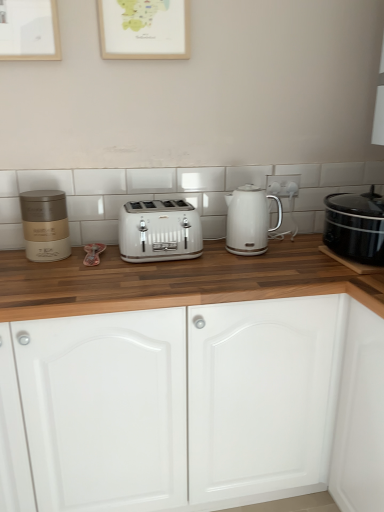
Describe the element at coordinates (159, 231) in the screenshot. I see `white metallic toaster at center` at that location.

The height and width of the screenshot is (512, 384). What do you see at coordinates (177, 281) in the screenshot? I see `white glossy cabinet doors at center` at bounding box center [177, 281].

Identify the location of white glossy cabinet doors at center. The image size is (384, 512). (177, 281).

The height and width of the screenshot is (512, 384). What are the coordinates of `white glossy electric outlet at upper center` in the screenshot? It's located at (283, 185).

Find the location of a particular element. The image size is (384, 512). white metallic toaster at center is located at coordinates (159, 231).

Between white glossy cabinet doors at center and white glossy electric outlet at upper center, which one appears on the left side from the viewer's perspective?

white glossy cabinet doors at center is more to the left.

Which object is thinner, white glossy cabinet doors at center or white glossy electric outlet at upper center?

Thinner between the two is white glossy electric outlet at upper center.

Looking at this image, considering the relative sizes of white glossy cabinet doors at center and white glossy electric outlet at upper center in the image provided, is white glossy cabinet doors at center shorter than white glossy electric outlet at upper center?

No, white glossy cabinet doors at center is not shorter than white glossy electric outlet at upper center.

The height and width of the screenshot is (512, 384). Find the location of `picture frame on the right of matte gold container at left`. picture frame on the right of matte gold container at left is located at coordinates (144, 29).

Considering the positions of point (130, 21) and point (55, 253), is point (130, 21) closer or farther from the camera than point (55, 253)?

Clearly, point (130, 21) is closer to the camera than point (55, 253).

Is matte gold container at left completely or partially inside wooden picture frame at upper center?

No.

Are wooden picture frame at upper center and matte gold container at left beside each other?

wooden picture frame at upper center is not next to matte gold container at left, and they're not touching.

Is white glossy electric kettle at center inside or outside of white glossy cabinet doors at center?

white glossy electric kettle at center exists outside the volume of white glossy cabinet doors at center.

In the image, is white glossy electric kettle at center on the left side or the right side of white glossy cabinet doors at center?

white glossy electric kettle at center is positioned on white glossy cabinet doors at center's right side.

Is white glossy electric kettle at center bigger or smaller than white glossy cabinet doors at center?

white glossy electric kettle at center is smaller than white glossy cabinet doors at center.

From a real-world perspective, which is physically below, white glossy cabinet doors at center or matte gold container at left?

From a 3D spatial view, white glossy cabinet doors at center is below.

Is matte gold container at left surrounded by white glossy cabinet doors at center?

No.

Which object is positioned more to the right, white glossy cabinet doors at center or matte gold container at left?

white glossy cabinet doors at center.

Is matte gold container at left at the back of white glossy cabinet doors at center?

That's not correct — white glossy cabinet doors at center is not looking away from matte gold container at left.

From the image's perspective, is white glossy cabinet doors at center below white glossy electric kettle at center?

Indeed, from the image's perspective, white glossy cabinet doors at center is shown beneath white glossy electric kettle at center.

Is point (199, 297) positioned behind point (240, 227)?

No, it is not.

Considering the sizes of objects white glossy cabinet doors at center and white glossy electric kettle at center in the image provided, who is wider, white glossy cabinet doors at center or white glossy electric kettle at center?

With larger width is white glossy cabinet doors at center.

Is wooden picture frame at upper center in front of or behind white glossy cabinet doors at center in the image?

Visually, wooden picture frame at upper center is located behind white glossy cabinet doors at center.

This screenshot has width=384, height=512. In order to click on picture frame on the right of white glossy cabinet doors at center in this screenshot , I will do `click(144, 29)`.

Which of these two, wooden picture frame at upper center or white glossy cabinet doors at center, is smaller?

wooden picture frame at upper center is smaller.

Considering the positions of objects wooden picture frame at upper center and white glossy cabinet doors at center in the image provided, who is more to the right, wooden picture frame at upper center or white glossy cabinet doors at center?

From the viewer's perspective, wooden picture frame at upper center appears more on the right side.

Is white metallic toaster at center not near black glossy slow cooker at right?

white metallic toaster at center is actually quite close to black glossy slow cooker at right.

Does white metallic toaster at center have a lesser height compared to black glossy slow cooker at right?

Yes, white metallic toaster at center is shorter than black glossy slow cooker at right.

Considering the relative positions of white metallic toaster at center and black glossy slow cooker at right in the image provided, is white metallic toaster at center to the right of black glossy slow cooker at right from the viewer's perspective?

In fact, white metallic toaster at center is to the left of black glossy slow cooker at right.

Image resolution: width=384 pixels, height=512 pixels. In order to click on electric outlet above the white glossy cabinet doors at center (from the image's perspective) in this screenshot , I will do `click(283, 185)`.

The image size is (384, 512). Find the location of `picture frame above the matte gold container at left (from a real-world perspective)`. picture frame above the matte gold container at left (from a real-world perspective) is located at coordinates (144, 29).

Estimate the real-world distances between objects in this image. Which object is closer to white glossy electric kettle at center, matte gold container at left or wooden picture frame at upper center?

wooden picture frame at upper center is positioned closer to the anchor white glossy electric kettle at center.

Estimate the real-world distances between objects in this image. Which object is further from wooden picture frame at upper center, white glossy electric outlet at upper center or white glossy electric kettle at center?

Based on the image, white glossy electric outlet at upper center appears to be further to wooden picture frame at upper center.

Considering their positions, is white glossy electric outlet at upper center positioned further to white glossy electric kettle at center than white glossy cabinet doors at center?

white glossy cabinet doors at center lies further to white glossy electric kettle at center than the other object.

Based on their spatial positions, is black glossy slow cooker at right or white glossy cabinet doors at center further from wooden picture frame at upper center?

black glossy slow cooker at right is positioned further to the anchor wooden picture frame at upper center.

Based on their spatial positions, is white metallic toaster at center or matte gold container at left further from wooden picture frame at upper center?

matte gold container at left lies further to wooden picture frame at upper center than the other object.

From the image, which object appears to be nearer to white glossy cabinet doors at center, white glossy electric outlet at upper center or white metallic toaster at center?

Based on the image, white metallic toaster at center appears to be nearer to white glossy cabinet doors at center.

Based on their spatial positions, is white glossy electric outlet at upper center or wooden picture frame at upper center further from black glossy slow cooker at right?

wooden picture frame at upper center is positioned further to the anchor black glossy slow cooker at right.

Estimate the real-world distances between objects in this image. Which object is further from white metallic toaster at center, white glossy cabinet doors at center or black glossy slow cooker at right?

The object further to white metallic toaster at center is black glossy slow cooker at right.

This screenshot has width=384, height=512. Find the location of `toaster situated between matte gold container at left and white glossy electric outlet at upper center from left to right`. toaster situated between matte gold container at left and white glossy electric outlet at upper center from left to right is located at coordinates (159, 231).

You are a GUI agent. You are given a task and a screenshot of the screen. Output one action in this format:
    pyautogui.click(x=<x>, y=<y>)
    Task: Click on the picture frame between matte gold container at left and white glossy electric outlet at upper center in the horizontal direction
    
    Given the screenshot: What is the action you would take?
    pyautogui.click(x=144, y=29)

Find the location of a particular element. The height and width of the screenshot is (512, 384). kitchen appliance between matte gold container at left and white glossy electric outlet at upper center is located at coordinates (249, 220).

This screenshot has width=384, height=512. What are the coordinates of `toaster between white glossy cabinet doors at center and black glossy slow cooker at right from left to right` in the screenshot? It's located at (159, 231).